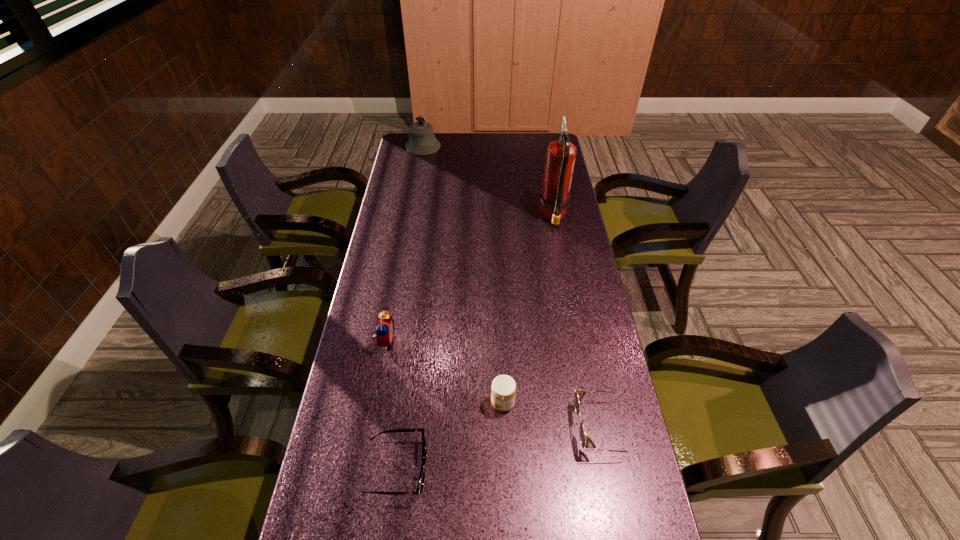
Locate an element on the screen. The image size is (960, 540). the left sunglasses is located at coordinates (420, 485).

This screenshot has height=540, width=960. In order to click on free space located at the nozzle of the tallest object in this screenshot , I will do `click(507, 217)`.

This screenshot has height=540, width=960. Identify the location of vacant space located at the nozzle of the tallest object. (489, 217).

Locate an element on the screen. vacant space located at the nozzle of the tallest object is located at coordinates (466, 217).

This screenshot has width=960, height=540. In order to click on vacant space located 0.300m on the front of the bell in this screenshot , I will do `click(415, 194)`.

Locate an element on the screen. The image size is (960, 540). vacant space located 0.050m on the front-facing side of the fourth shortest object is located at coordinates (411, 341).

This screenshot has width=960, height=540. What are the coordinates of `vacant space located 0.370m on the front label of the jam` in the screenshot? It's located at (351, 403).

Where is `vacant point located on the front label of the jam`? This screenshot has height=540, width=960. vacant point located on the front label of the jam is located at coordinates (442, 403).

Locate an element on the screen. This screenshot has width=960, height=540. free region located 0.080m on the front label of the jam is located at coordinates coord(461,403).

Find the location of a particular element. Image resolution: width=960 pixels, height=540 pixels. vacant area situated on the front lenses of the taller sunglasses is located at coordinates (470, 428).